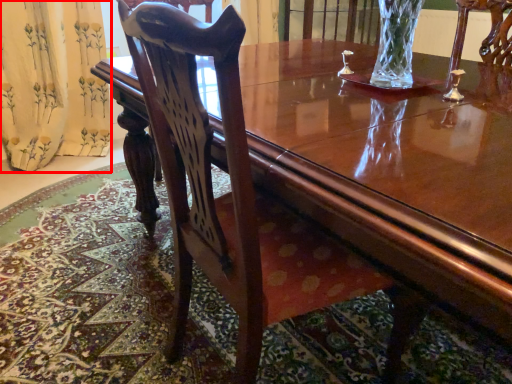
Question: Considering the relative positions of curtain (annotated by the red box) and chair in the image provided, where is curtain (annotated by the red box) located with respect to the staircase?

Choices:
 (A) right
 (B) left

Answer: (B)